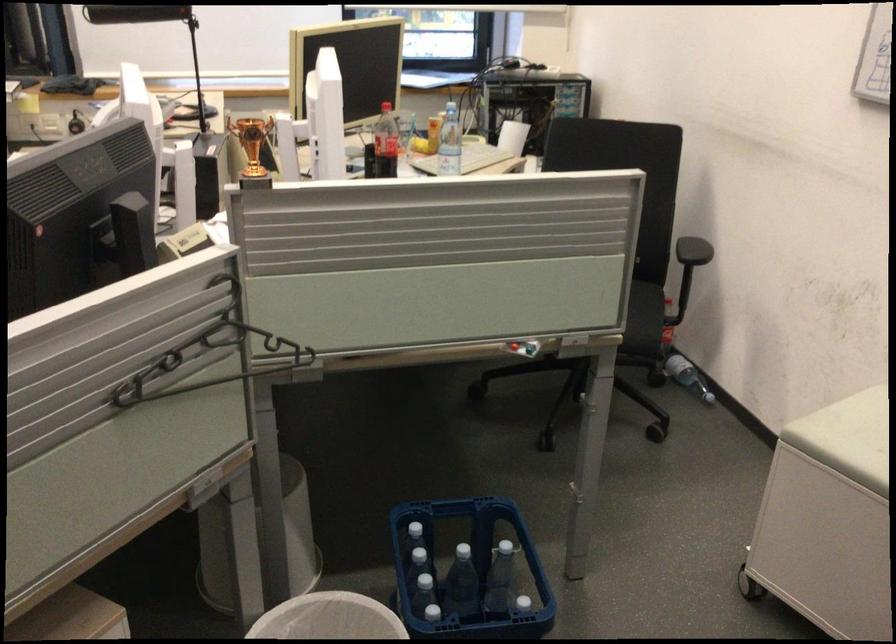
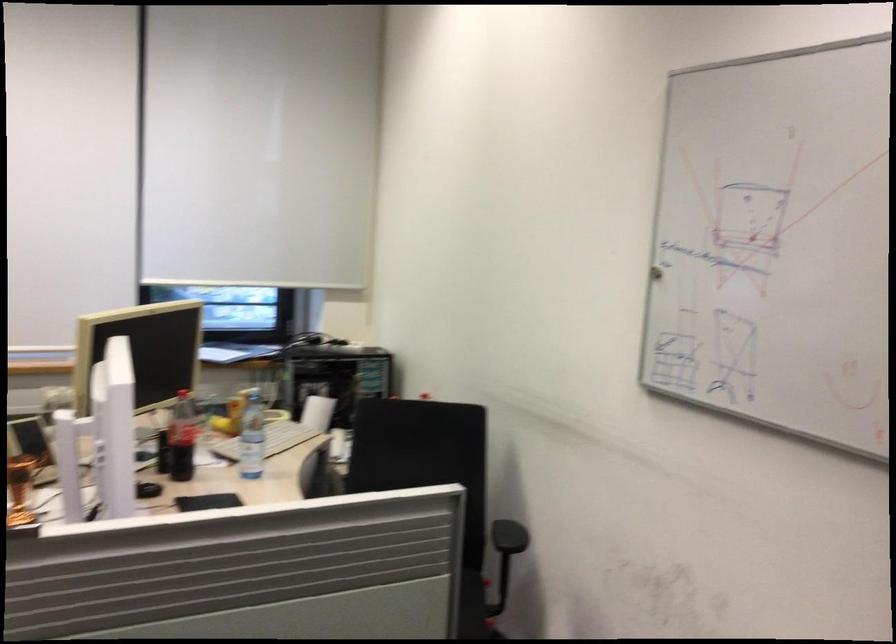
Find the pixel in the second image that matches pixel 389 147 in the first image.

(182, 438)